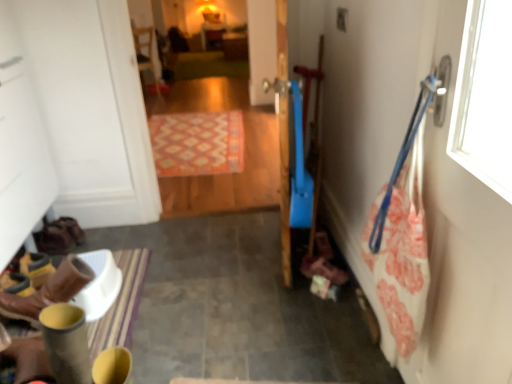
Question: Can you see brown leather boots at lower left touching patterned carpet at center?

Choices:
 (A) yes
 (B) no

Answer: (B)

Question: Does brown leather boots at lower left have a smaller size compared to patterned carpet at center?

Choices:
 (A) yes
 (B) no

Answer: (A)

Question: Is brown leather boots at lower left in front of patterned carpet at center?

Choices:
 (A) yes
 (B) no

Answer: (A)

Question: Considering the relative sizes of brown leather boots at lower left and patterned carpet at center in the image provided, is brown leather boots at lower left taller than patterned carpet at center?

Choices:
 (A) no
 (B) yes

Answer: (A)

Question: From a real-world perspective, does brown leather boots at lower left sit lower than patterned carpet at center?

Choices:
 (A) yes
 (B) no

Answer: (A)

Question: In terms of size, does wooden chair at upper center appear bigger or smaller than patterned carpet at center?

Choices:
 (A) big
 (B) small

Answer: (B)

Question: Does point (145, 31) appear closer or farther from the camera than point (274, 59)?

Choices:
 (A) farther
 (B) closer

Answer: (A)

Question: From a real-world perspective, is wooden chair at upper center physically located above or below patterned carpet at center?

Choices:
 (A) above
 (B) below

Answer: (B)

Question: Would you say wooden chair at upper center is to the left or to the right of patterned carpet at center in the picture?

Choices:
 (A) left
 (B) right

Answer: (A)

Question: Considering the positions of patterned carpet at center and patterned carpet at center in the image, is patterned carpet at center wider or thinner than patterned carpet at center?

Choices:
 (A) wide
 (B) thin

Answer: (B)

Question: Is patterned carpet at center taller or shorter than patterned carpet at center?

Choices:
 (A) short
 (B) tall

Answer: (B)

Question: Considering the relative positions of patterned carpet at center and patterned carpet at center in the image provided, is patterned carpet at center to the left or to the right of patterned carpet at center?

Choices:
 (A) left
 (B) right

Answer: (B)

Question: From the image's perspective, is patterned carpet at center positioned above or below patterned carpet at center?

Choices:
 (A) above
 (B) below

Answer: (B)

Question: Looking at the image, does wooden chair at upper center seem bigger or smaller compared to patterned carpet at center?

Choices:
 (A) small
 (B) big

Answer: (B)

Question: Looking at their shapes, would you say wooden chair at upper center is wider or thinner than patterned carpet at center?

Choices:
 (A) wide
 (B) thin

Answer: (B)